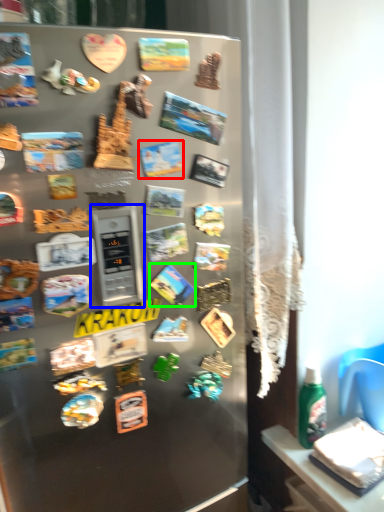
Question: Which object is the farthest from comic book (highlighted by a red box)? Choose among these: appliance (highlighted by a blue box) or comic book (highlighted by a green box).

Choices:
 (A) appliance
 (B) comic book

Answer: (B)